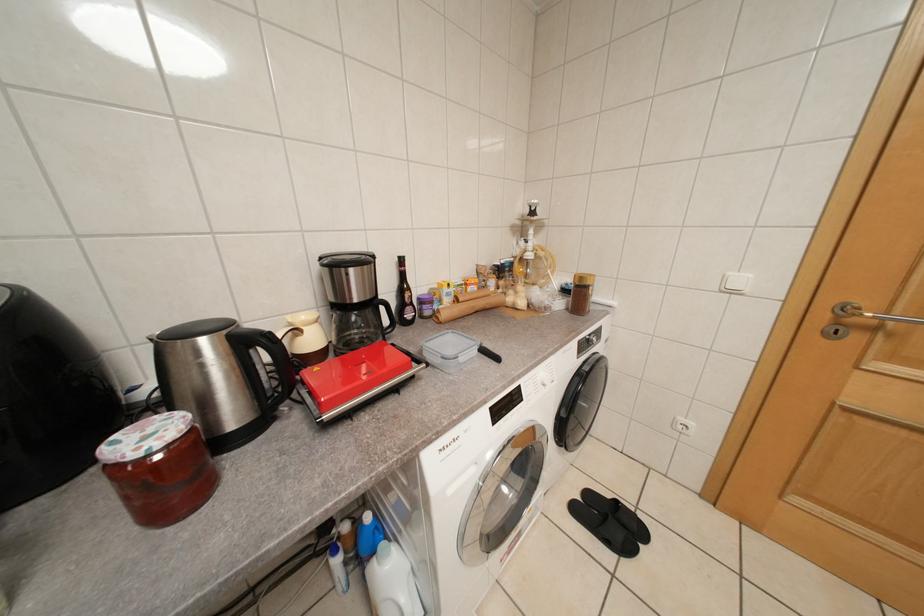
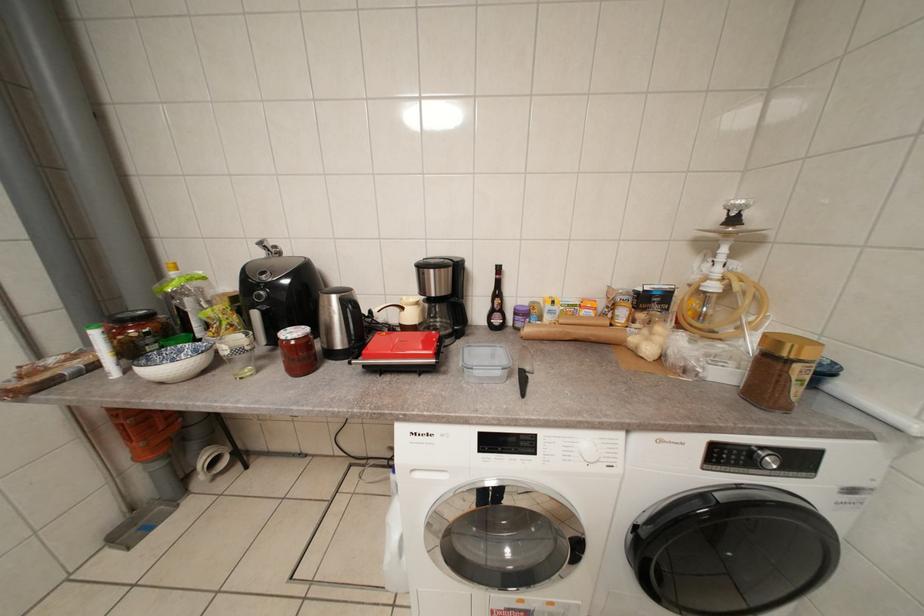
Question: The camera is either moving clockwise (left) or counter-clockwise (right) around the object. The first image is from the beginning of the video and the second image is from the end. Is the camera moving left or right when shooting the video?

Choices:
 (A) Left
 (B) Right

Answer: (B)